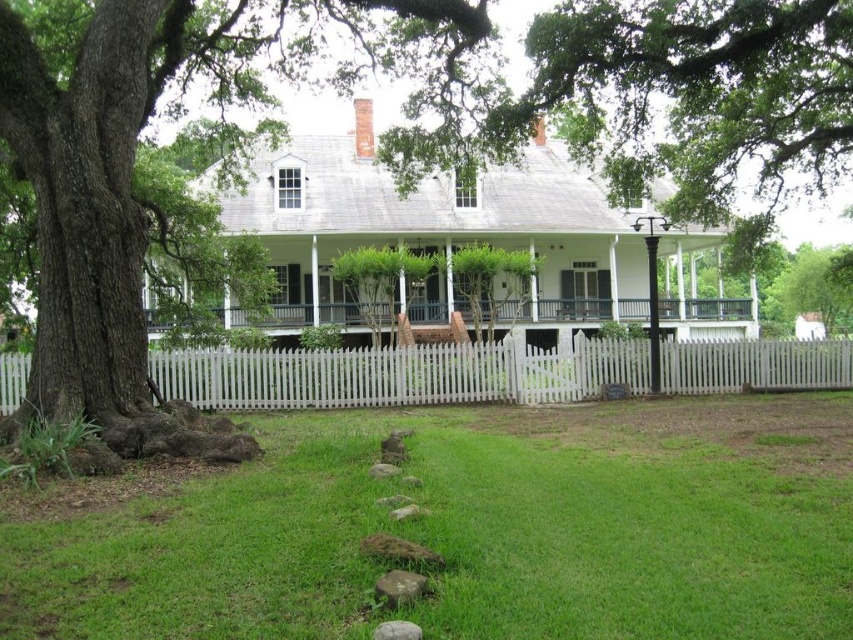
Question: In this image, where is green grass at lower center located relative to white picket fence at center?

Choices:
 (A) left
 (B) right

Answer: (B)

Question: Estimate the real-world distances between objects in this image. Which object is closer to the green grass at lower center?

Choices:
 (A) white picket fence at center
 (B) white wooden porch at center
 (C) smooth bark tree at left

Answer: (C)

Question: Estimate the real-world distances between objects in this image. Which object is closer to the white picket fence at center?

Choices:
 (A) white wooden porch at center
 (B) smooth bark tree at left

Answer: (B)

Question: Considering the real-world distances, which object is closest to the white wooden porch at center?

Choices:
 (A) white picket fence at center
 (B) green grass at lower center
 (C) smooth bark tree at left

Answer: (A)

Question: Is smooth bark tree at left to the right of white wooden porch at center from the viewer's perspective?

Choices:
 (A) no
 (B) yes

Answer: (A)

Question: Is smooth bark tree at left further to camera compared to white picket fence at center?

Choices:
 (A) no
 (B) yes

Answer: (A)